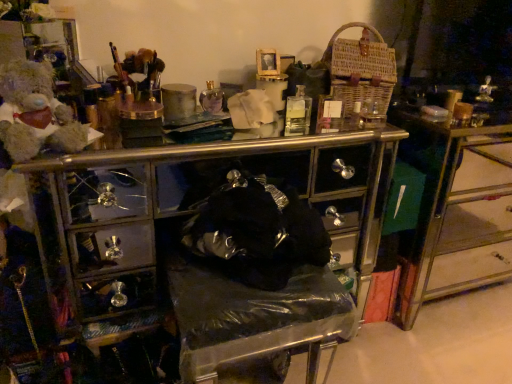
Describe the element at coordinates (35, 113) in the screenshot. I see `fluffy beige teddy bear at left` at that location.

What is the approximate width of woven brown basket at upper right?

woven brown basket at upper right is 10.80 inches wide.

Where is `fluffy beige teddy bear at left`? This screenshot has width=512, height=384. fluffy beige teddy bear at left is located at coordinates (35, 113).

Locate an element on the screen. table that is on the right side of woven brown basket at upper right is located at coordinates (457, 207).

Which of these two, woven brown basket at upper right or metallic/golden drawer at right, stands shorter?

Standing shorter between the two is woven brown basket at upper right.

From a real-world perspective, which object stands above the other?

woven brown basket at upper right is physically above.

Can you confirm if woven brown basket at upper right is wider than metallic/golden drawer at right?

No.

Between point (2, 117) and point (415, 299), which one is positioned behind?

The point (415, 299) is more distant.

Is fluffy beige teddy bear at left turned away from metallic/golden drawer at right?

fluffy beige teddy bear at left does not have its back to metallic/golden drawer at right.

Looking at this image, is fluffy beige teddy bear at left inside or outside of woven brown basket at upper right?

fluffy beige teddy bear at left is outside woven brown basket at upper right.

Image resolution: width=512 pixels, height=384 pixels. I want to click on teddy that is on the left side of woven brown basket at upper right, so click(x=35, y=113).

Considering the points (14, 120) and (335, 46), which point is in front, point (14, 120) or point (335, 46)?

The point (14, 120) is closer to the camera.

Does fluffy beige teddy bear at left lie in front of woven brown basket at upper right?

Yes, it is.

Looking at their sizes, would you say woven brown basket at upper right is wider or thinner than fluffy beige teddy bear at left?

Clearly, woven brown basket at upper right has more width compared to fluffy beige teddy bear at left.

Does woven brown basket at upper right contain fluffy beige teddy bear at left?

That's incorrect, fluffy beige teddy bear at left is not inside woven brown basket at upper right.

Considering the positions of points (371, 52) and (50, 123), is point (371, 52) farther from camera compared to point (50, 123)?

Yes, point (371, 52) is behind point (50, 123).

From the image's perspective, which object appears higher, woven brown basket at upper right or fluffy beige teddy bear at left?

woven brown basket at upper right appears higher in the image.

In the image, is metallic/golden drawer at right positioned in front of or behind woven brown basket at upper right?

Clearly, metallic/golden drawer at right is behind woven brown basket at upper right.

Is point (462, 255) positioned before point (331, 43)?

No, (462, 255) is behind (331, 43).

Can we say metallic/golden drawer at right lies outside woven brown basket at upper right?

Yes, metallic/golden drawer at right is not within woven brown basket at upper right.

Is metallic/golden drawer at right facing towards woven brown basket at upper right?

No, metallic/golden drawer at right is not turned towards woven brown basket at upper right.

Looking at this image, which object is positioned more to the left, metallic/golden drawer at right or fluffy beige teddy bear at left?

From the viewer's perspective, fluffy beige teddy bear at left appears more on the left side.

From a real-world perspective, is metallic/golden drawer at right located beneath fluffy beige teddy bear at left?

Correct, in the physical world, metallic/golden drawer at right is lower than fluffy beige teddy bear at left.

The height and width of the screenshot is (384, 512). In order to click on table beneath the woven brown basket at upper right (from a real-world perspective) in this screenshot , I will do [x=457, y=207].

Where is `table below the fluffy beige teddy bear at left (from the image's perspective)`? table below the fluffy beige teddy bear at left (from the image's perspective) is located at coordinates (457, 207).

In the scene shown: Which object lies nearer to the anchor point woven brown basket at upper right, metallic/golden drawer at right or fluffy beige teddy bear at left?

metallic/golden drawer at right.

Considering their positions, is woven brown basket at upper right positioned further to metallic/golden drawer at right than fluffy beige teddy bear at left?

Based on the image, fluffy beige teddy bear at left appears to be further to metallic/golden drawer at right.

From the image, which object appears to be farther from woven brown basket at upper right, fluffy beige teddy bear at left or metallic/golden drawer at right?

The object further to woven brown basket at upper right is fluffy beige teddy bear at left.

Which object lies further to the anchor point fluffy beige teddy bear at left, metallic/golden drawer at right or woven brown basket at upper right?

metallic/golden drawer at right is positioned further to the anchor fluffy beige teddy bear at left.

Looking at the image, which one is located further to metallic/golden drawer at right, fluffy beige teddy bear at left or woven brown basket at upper right?

fluffy beige teddy bear at left.

Which object lies nearer to the anchor point fluffy beige teddy bear at left, woven brown basket at upper right or metallic/golden drawer at right?

woven brown basket at upper right.

The image size is (512, 384). I want to click on crate located between fluffy beige teddy bear at left and metallic/golden drawer at right in the left-right direction, so click(x=361, y=69).